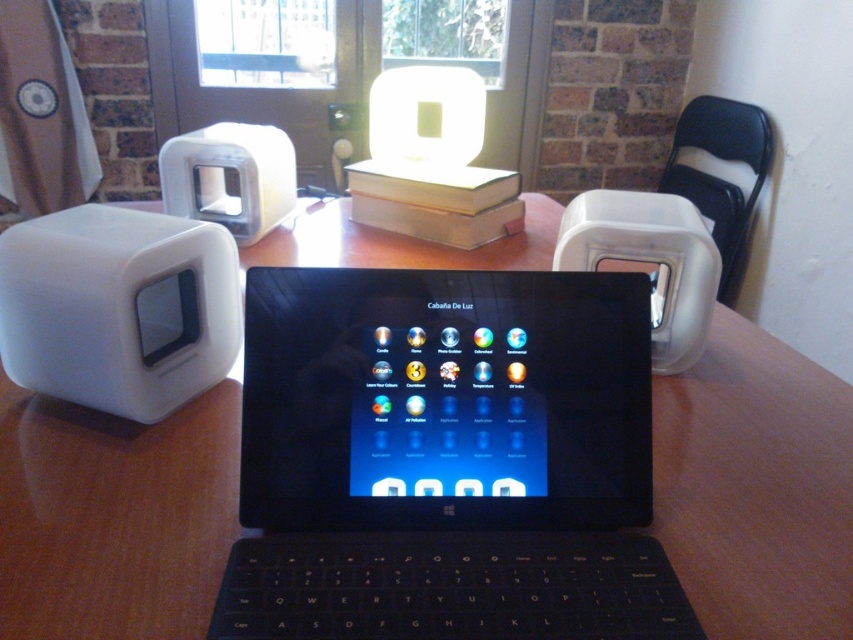
Between white plastic toaster at left and white matte toaster at right, which one is positioned lower?

white plastic toaster at left is below.

Is white plastic toaster at left smaller than white matte toaster at right?

Indeed, white plastic toaster at left has a smaller size compared to white matte toaster at right.

Does point (216, 339) come closer to viewer compared to point (613, 209)?

Yes, it is.

Image resolution: width=853 pixels, height=640 pixels. I want to click on white plastic toaster at left, so click(x=119, y=308).

Who is positioned more to the left, black plastic laptop at center or white matte toaster at right?

From the viewer's perspective, black plastic laptop at center appears more on the left side.

At what (x,y) coordinates should I click in order to perform the action: click on black plastic laptop at center. Please return your answer as a coordinate pair (x, y). Image resolution: width=853 pixels, height=640 pixels. Looking at the image, I should click on (445, 460).

Is point (108, 291) less distant than point (265, 209)?

Yes.

Which is below, white plastic toaster at left or white matte toaster at upper left?

white plastic toaster at left is lower down.

Which is in front, point (22, 371) or point (164, 166)?

Point (22, 371)

Where is `white plastic toaster at left`? Image resolution: width=853 pixels, height=640 pixels. white plastic toaster at left is located at coordinates (119, 308).